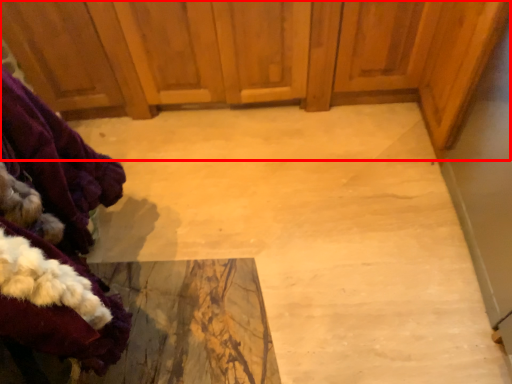
Question: From the image's perspective, considering the relative positions of dresser (annotated by the red box) and clothing in the image provided, where is dresser (annotated by the red box) located with respect to the staircase?

Choices:
 (A) below
 (B) above

Answer: (B)